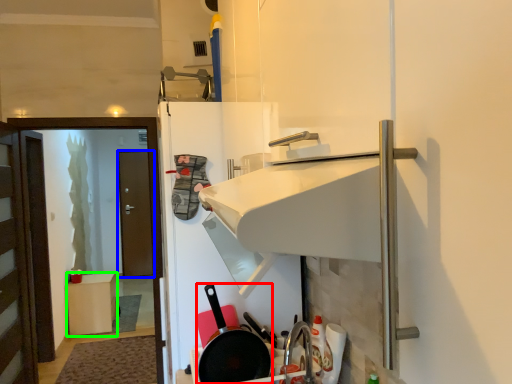
Question: Which is farther away from frying pan (highlighted by a red box)? door (highlighted by a blue box) or furniture (highlighted by a green box)?

Choices:
 (A) door
 (B) furniture

Answer: (A)